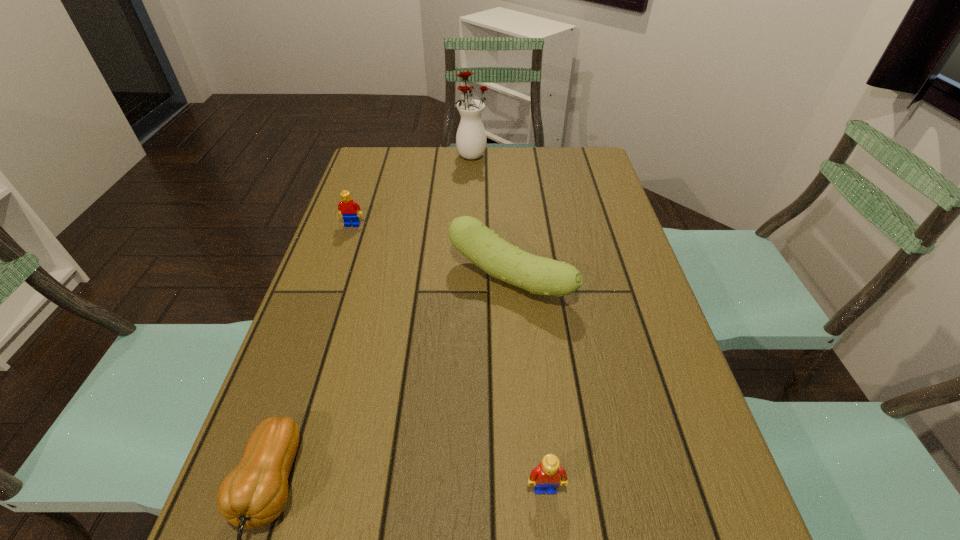
You are a GUI agent. You are given a task and a screenshot of the screen. Output one action in this format:
    pyautogui.click(x=<x>, y=<y>)
    Task: Click on the vase
    The image size is (960, 540).
    Given the screenshot: What is the action you would take?
    pyautogui.click(x=471, y=140)

Where is `the farthest object`? the farthest object is located at coordinates (471, 140).

Where is `cucumber`? This screenshot has height=540, width=960. cucumber is located at coordinates (539, 275).

Image resolution: width=960 pixels, height=540 pixels. What are the coordinates of `the farther Lego` in the screenshot? It's located at (347, 207).

Locate an element on the screen. the left Lego is located at coordinates click(347, 207).

Identify the location of the right Lego. (546, 475).

Find the location of a particular element. free space located on the left of the vase is located at coordinates 401,155.

Identify the location of free space located on the left of the third farthest object. (428, 278).

Image resolution: width=960 pixels, height=540 pixels. Find the location of `vacant space located on the front-facing side of the left Lego`. vacant space located on the front-facing side of the left Lego is located at coordinates (335, 275).

Where is `object that is at the far edge`? object that is at the far edge is located at coordinates (471, 140).